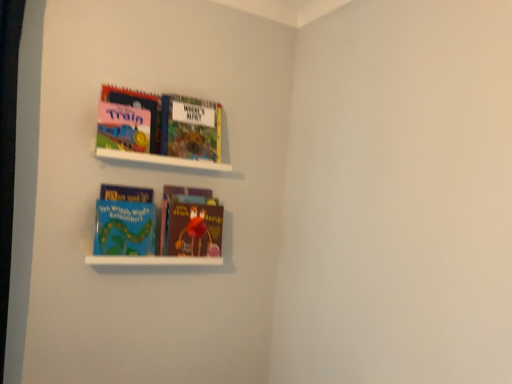
Question: Which direction should I rotate to look at white matte bookshelf at upper center, the first cabinet from the top, — up or down?

Choices:
 (A) up
 (B) down

Answer: (A)

Question: From the image's perspective, is hardcover book at upper center, the 3th book from the bottom, located above white matte bookshelf at upper center, placed as the 2th cabinet when sorted from bottom to top?

Choices:
 (A) yes
 (B) no

Answer: (A)

Question: Is hardcover book at upper center, the 2th book viewed from the top, shorter than white matte bookshelf at upper center, the first cabinet from the top?

Choices:
 (A) no
 (B) yes

Answer: (A)

Question: Are hardcover book at upper center, the 2th book viewed from the top, and white matte bookshelf at upper center, the first cabinet from the top, making contact?

Choices:
 (A) no
 (B) yes

Answer: (A)

Question: From a real-world perspective, is hardcover book at upper center, the 3th book from the bottom, over white matte bookshelf at upper center, the first cabinet from the top?

Choices:
 (A) no
 (B) yes

Answer: (B)

Question: Is hardcover book at upper center, the 2th book viewed from the top, taller than white matte bookshelf at upper center, the first cabinet from the top?

Choices:
 (A) no
 (B) yes

Answer: (B)

Question: Would you say hardcover book at upper center, the 3th book from the bottom, is a long distance from white matte bookshelf at upper center, placed as the 2th cabinet when sorted from bottom to top?

Choices:
 (A) yes
 (B) no

Answer: (B)

Question: Considering the relative sizes of brown matte book at center, acting as the 4th book starting from the top, and matte pink board book at upper left, the 4th book positioned from the bottom, in the image provided, is brown matte book at center, acting as the 4th book starting from the top, shorter than matte pink board book at upper left, the 4th book positioned from the bottom,?

Choices:
 (A) yes
 (B) no

Answer: (B)

Question: Considering the relative sizes of brown matte book at center, placed as the first book when sorted from bottom to top, and matte pink board book at upper left, the 1th book positioned from the top, in the image provided, is brown matte book at center, placed as the first book when sorted from bottom to top, bigger than matte pink board book at upper left, the 1th book positioned from the top,?

Choices:
 (A) no
 (B) yes

Answer: (B)

Question: Is matte pink board book at upper left, the 1th book positioned from the top, inside brown matte book at center, acting as the 4th book starting from the top?

Choices:
 (A) no
 (B) yes

Answer: (A)

Question: From a real-world perspective, does brown matte book at center, acting as the 4th book starting from the top, stand above matte pink board book at upper left, the 1th book positioned from the top?

Choices:
 (A) yes
 (B) no

Answer: (B)

Question: Is brown matte book at center, acting as the 4th book starting from the top, aimed at matte pink board book at upper left, the 1th book positioned from the top?

Choices:
 (A) yes
 (B) no

Answer: (B)

Question: From a real-world perspective, is matte pink board book at upper left, the 1th book positioned from the top, under brown matte book at center, placed as the first book when sorted from bottom to top?

Choices:
 (A) no
 (B) yes

Answer: (A)